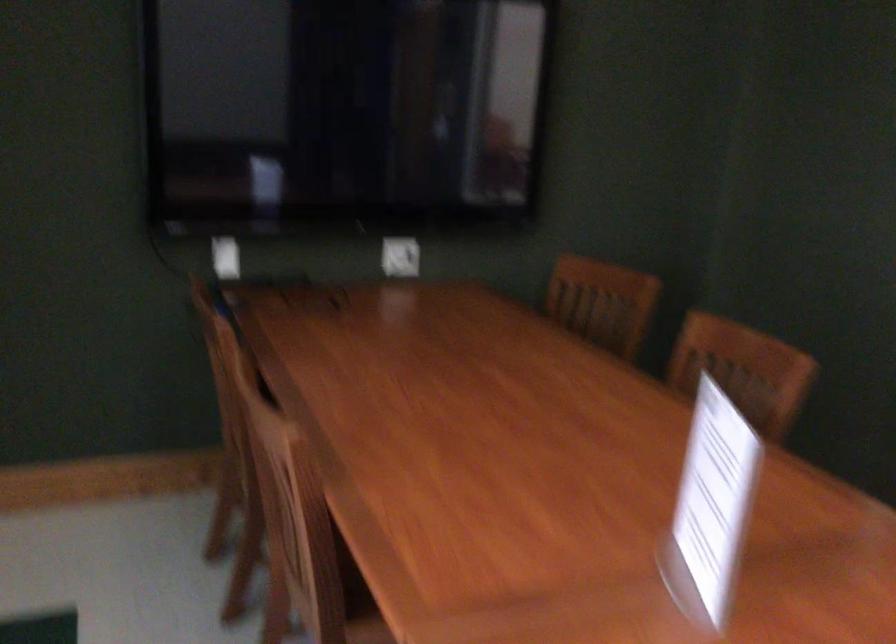
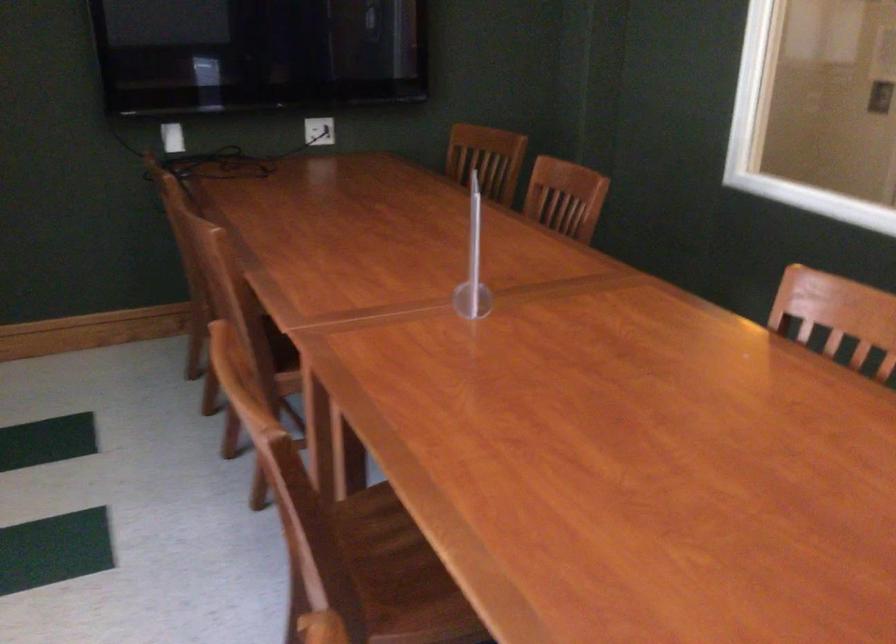
Locate, in the second image, the point that corresponds to point 652,489 in the first image.

(472, 263)